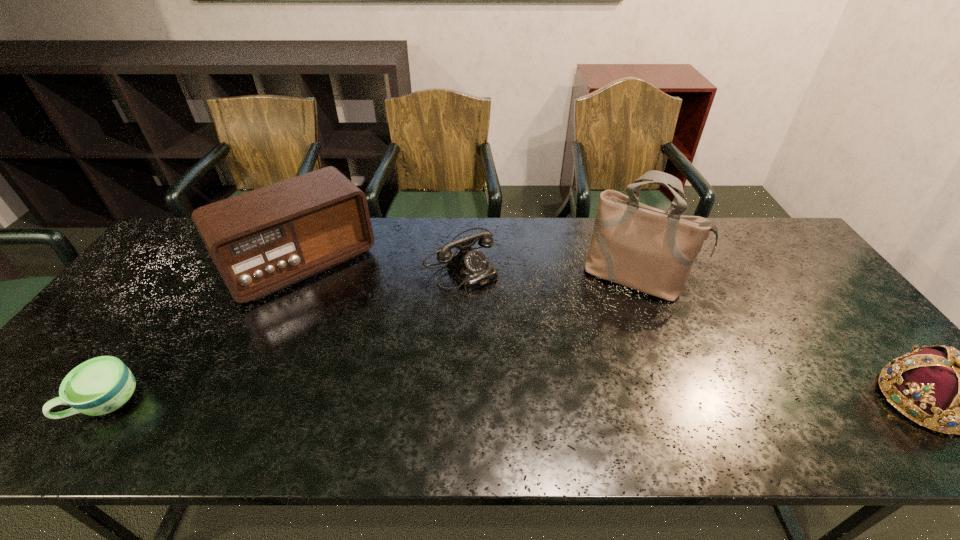
Locate an element on the screen. The width and height of the screenshot is (960, 540). vacant space on the desktop that is between the cup and the rightmost object and is positioned on the front-facing side of the radio receiver is located at coordinates (407, 402).

You are a GUI agent. You are given a task and a screenshot of the screen. Output one action in this format:
    pyautogui.click(x=<x>, y=<y>)
    Task: Click on the vacant space on the desktop that is between the shortest object and the rightmost object and is positioned on the front-facing side of the fourth object from left to right
    This screenshot has height=540, width=960.
    Given the screenshot: What is the action you would take?
    pyautogui.click(x=588, y=401)

Locate an element on the screen. vacant space on the desktop that is between the cup and the rightmost object and is positioned on the front-facing side of the third object from left to right is located at coordinates (586, 401).